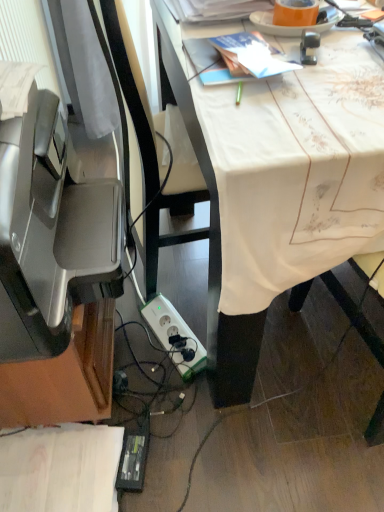
Question: Is white cloth-covered desk at center outside white plastic power plugs and sockets at lower center?

Choices:
 (A) yes
 (B) no

Answer: (A)

Question: Is white cloth-covered desk at center beside white plastic power plugs and sockets at lower center?

Choices:
 (A) yes
 (B) no

Answer: (B)

Question: Can you confirm if white cloth-covered desk at center is positioned to the left of white plastic power plugs and sockets at lower center?

Choices:
 (A) yes
 (B) no

Answer: (B)

Question: Is white cloth-covered desk at center surrounding white plastic power plugs and sockets at lower center?

Choices:
 (A) no
 (B) yes

Answer: (A)

Question: Considering the relative positions of white cloth-covered desk at center and white plastic power plugs and sockets at lower center in the image provided, is white cloth-covered desk at center to the right of white plastic power plugs and sockets at lower center from the viewer's perspective?

Choices:
 (A) yes
 (B) no

Answer: (A)

Question: From the image's perspective, relative to white cloth-covered desk at center, is satin silver printer at left above or below?

Choices:
 (A) above
 (B) below

Answer: (B)

Question: In terms of size, does satin silver printer at left appear bigger or smaller than white cloth-covered desk at center?

Choices:
 (A) small
 (B) big

Answer: (A)

Question: Is point (8, 198) positioned closer to the camera than point (342, 115)?

Choices:
 (A) closer
 (B) farther

Answer: (A)

Question: Looking at their shapes, would you say satin silver printer at left is wider or thinner than white cloth-covered desk at center?

Choices:
 (A) wide
 (B) thin

Answer: (B)

Question: From the image's perspective, is white cloth-covered desk at center positioned above or below satin silver printer at left?

Choices:
 (A) below
 (B) above

Answer: (B)

Question: From a real-world perspective, is white cloth-covered desk at center positioned above or below satin silver printer at left?

Choices:
 (A) above
 (B) below

Answer: (B)

Question: Based on their positions, is white cloth-covered desk at center located to the left or right of satin silver printer at left?

Choices:
 (A) left
 (B) right

Answer: (B)

Question: Is white cloth-covered desk at center wider or thinner than satin silver printer at left?

Choices:
 (A) wide
 (B) thin

Answer: (A)

Question: From the image's perspective, relative to satin silver printer at left, is white plastic power plugs and sockets at lower center above or below?

Choices:
 (A) above
 (B) below

Answer: (B)

Question: Considering the positions of white plastic power plugs and sockets at lower center and satin silver printer at left in the image, is white plastic power plugs and sockets at lower center taller or shorter than satin silver printer at left?

Choices:
 (A) tall
 (B) short

Answer: (B)